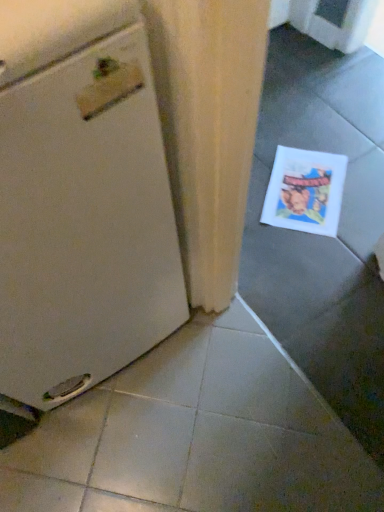
You are a GUI agent. You are given a task and a screenshot of the screen. Output one action in this format:
    pyautogui.click(x=<x>, y=<y>)
    Task: Click on the free space above white paper comic book at lower right (from a real-world perspective)
    Image resolution: width=384 pixels, height=512 pixels.
    Given the screenshot: What is the action you would take?
    pyautogui.click(x=306, y=190)